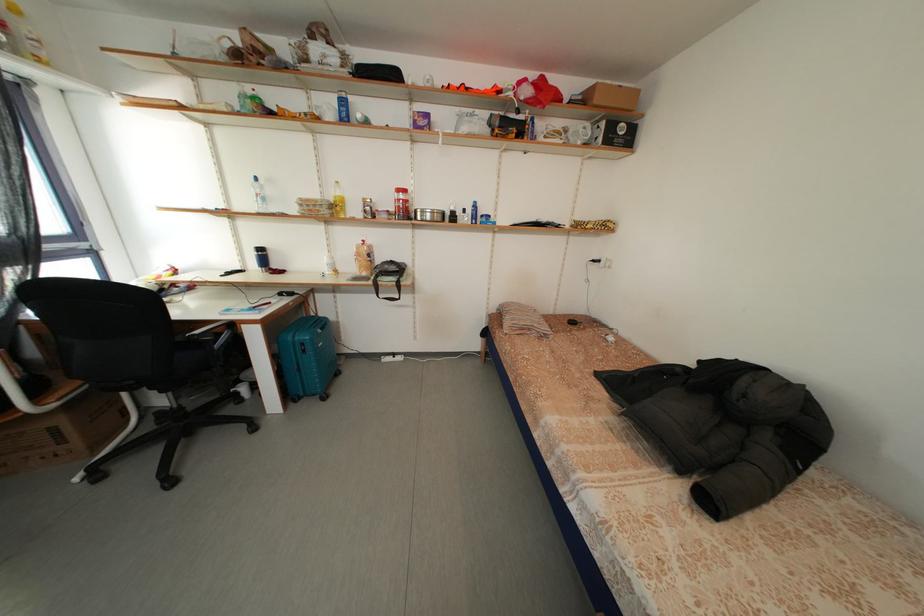
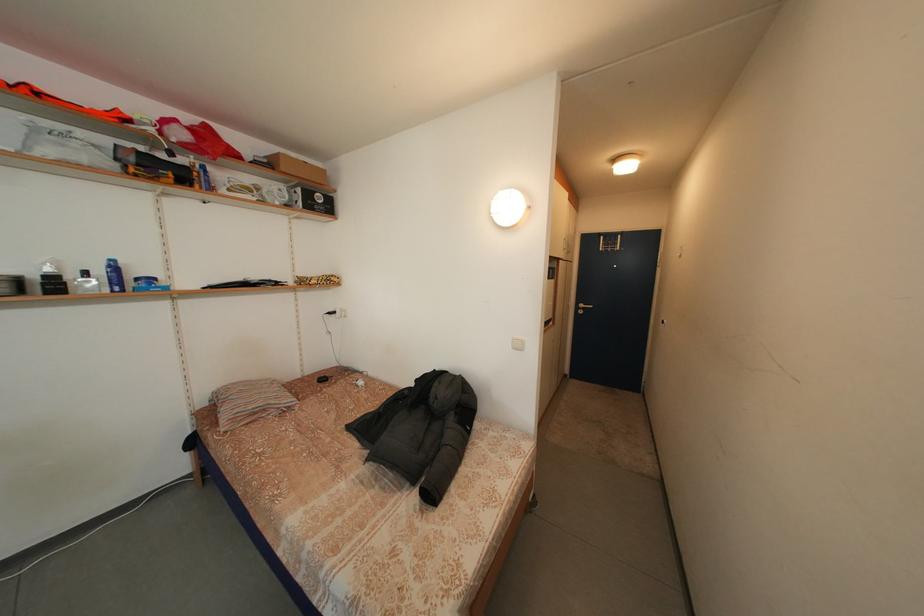
In the second image, find the point that corresponds to pixel 482 222 in the first image.

(125, 286)